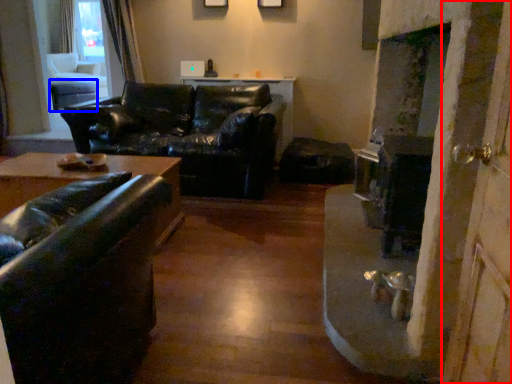
Question: Which point is closer to the camera, screen door (highlighted by a red box) or table (highlighted by a blue box)?

Choices:
 (A) screen door
 (B) table

Answer: (A)